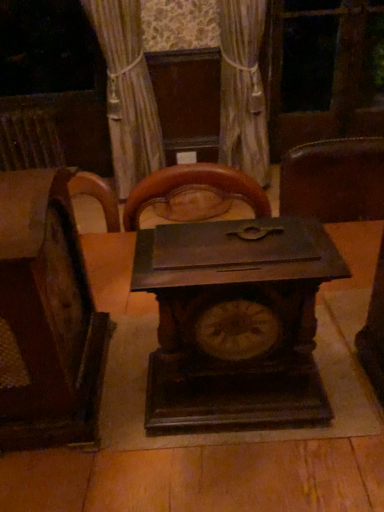
Question: Is dark wood table at center looking in the opposite direction of transparent glass screen door at upper center?

Choices:
 (A) yes
 (B) no

Answer: (B)

Question: From the image's perspective, does dark wood table at center appear lower than transparent glass screen door at upper center?

Choices:
 (A) no
 (B) yes

Answer: (B)

Question: Is dark wood table at center located outside transparent glass screen door at upper center?

Choices:
 (A) yes
 (B) no

Answer: (A)

Question: Is dark wood table at center touching transparent glass screen door at upper center?

Choices:
 (A) yes
 (B) no

Answer: (B)

Question: Considering the relative sizes of dark wood table at center and transparent glass screen door at upper center in the image provided, is dark wood table at center thinner than transparent glass screen door at upper center?

Choices:
 (A) no
 (B) yes

Answer: (A)

Question: Relative to dark wood table at center, is silky beige curtain at upper center in front or behind?

Choices:
 (A) behind
 (B) front

Answer: (A)

Question: Is silky beige curtain at upper center taller or shorter than dark wood table at center?

Choices:
 (A) tall
 (B) short

Answer: (A)

Question: From the image's perspective, is silky beige curtain at upper center positioned above or below dark wood table at center?

Choices:
 (A) below
 (B) above

Answer: (B)

Question: Is silky beige curtain at upper center wider or thinner than dark wood table at center?

Choices:
 (A) thin
 (B) wide

Answer: (A)

Question: Looking at their shapes, would you say dark wood table at center is wider or thinner than wooden chair at left?

Choices:
 (A) wide
 (B) thin

Answer: (A)

Question: From a real-world perspective, is dark wood table at center above or below wooden chair at left?

Choices:
 (A) below
 (B) above

Answer: (A)

Question: Considering the positions of dark wood table at center and wooden chair at left in the image, is dark wood table at center taller or shorter than wooden chair at left?

Choices:
 (A) tall
 (B) short

Answer: (A)

Question: Visually, is dark wood table at center positioned to the left or to the right of wooden chair at left?

Choices:
 (A) right
 (B) left

Answer: (A)

Question: Considering the relative positions of silky beige curtain at upper center and dark brown wood clock at center in the image provided, is silky beige curtain at upper center to the left or to the right of dark brown wood clock at center?

Choices:
 (A) left
 (B) right

Answer: (B)

Question: Considering the positions of silky beige curtain at upper center and dark brown wood clock at center in the image, is silky beige curtain at upper center wider or thinner than dark brown wood clock at center?

Choices:
 (A) wide
 (B) thin

Answer: (A)